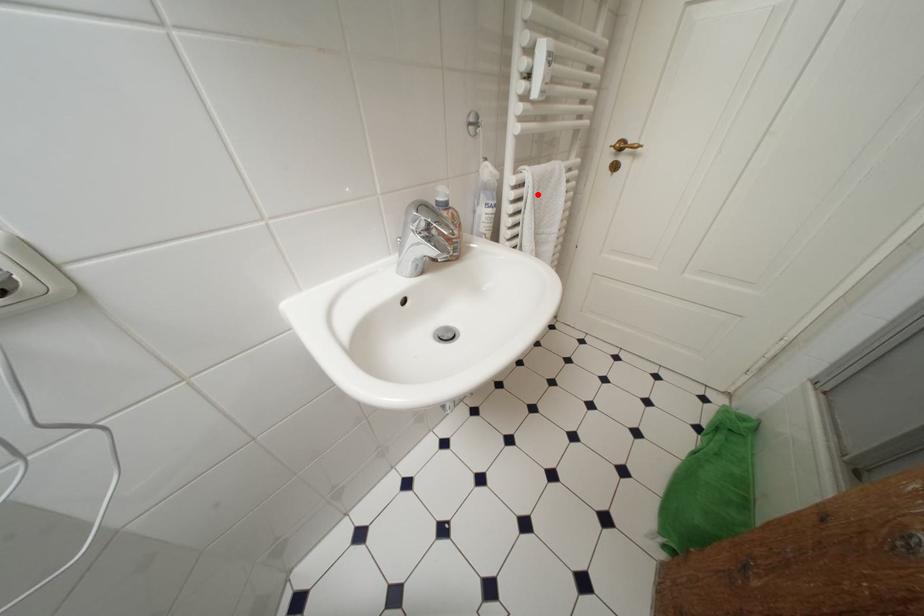
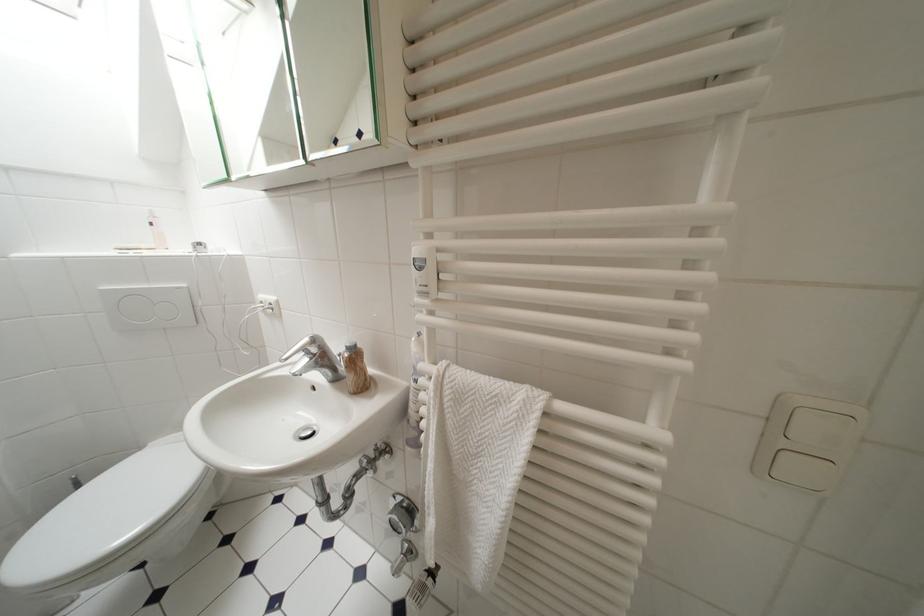
Question: I am providing you with two images of the same scene from different viewpoints. Image1 has a red point marked. In image2, the corresponding 3D location appears at what relative position? Reply with the corresponding letter.

Choices:
 (A) Closer
 (B) Farther

Answer: (B)